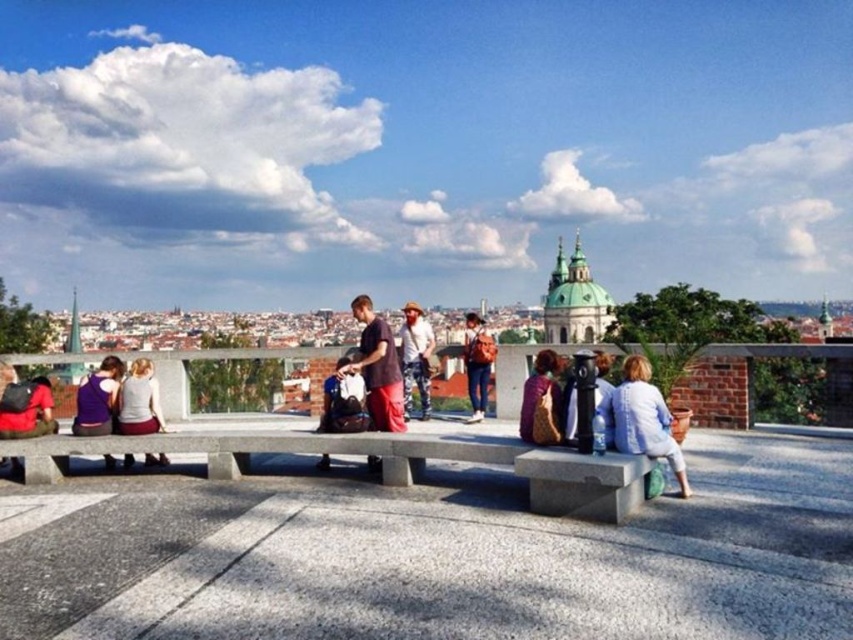
Question: In this image, where is purple fabric backpack at lower left located relative to matte black backpack at center?

Choices:
 (A) left
 (B) right

Answer: (A)

Question: Which object appears farthest from the camera in this image?

Choices:
 (A) white cotton shirt at lower left
 (B) matte black backpack at center
 (C) gray concrete bench at center

Answer: (B)

Question: Which object is farther from the camera taking this photo?

Choices:
 (A) leather backpack at center
 (B) metallic black telescope at center
 (C) matte red backpack at left

Answer: (C)

Question: Which object is the farthest from the white cotton shirt at lower left?

Choices:
 (A) matte black backpack at center
 (B) matte orange backpack at center
 (C) light blue denim jacket at lower right

Answer: (C)

Question: Can you confirm if light blue denim jacket at lower right is positioned to the left of metallic black telescope at center?

Choices:
 (A) no
 (B) yes

Answer: (A)

Question: Is light blue denim jacket at lower right wider than denim jacket at center?

Choices:
 (A) no
 (B) yes

Answer: (B)